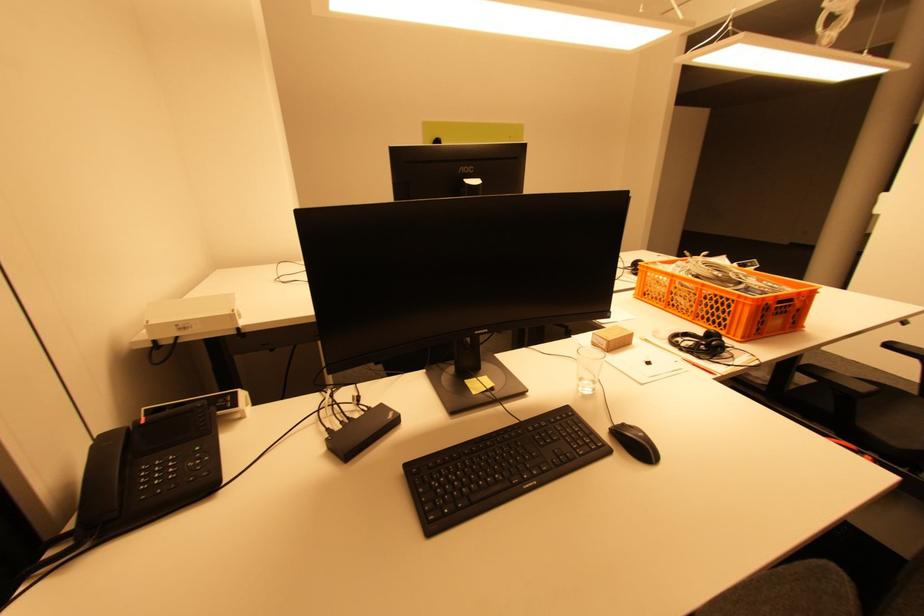
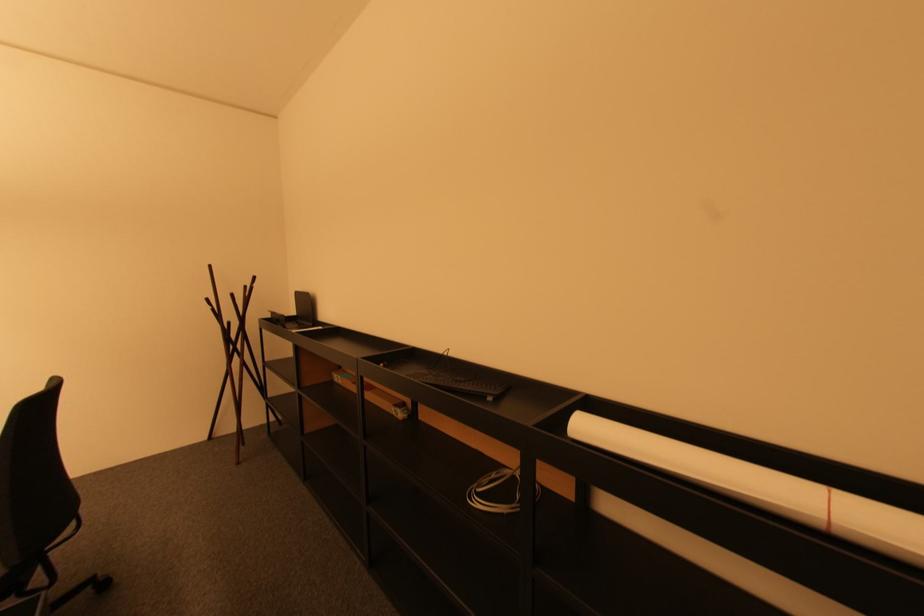
Question: The camera is either moving clockwise (left) or counter-clockwise (right) around the object. The first image is from the beginning of the video and the second image is from the end. Is the camera moving left or right when shooting the video?

Choices:
 (A) Left
 (B) Right

Answer: (A)